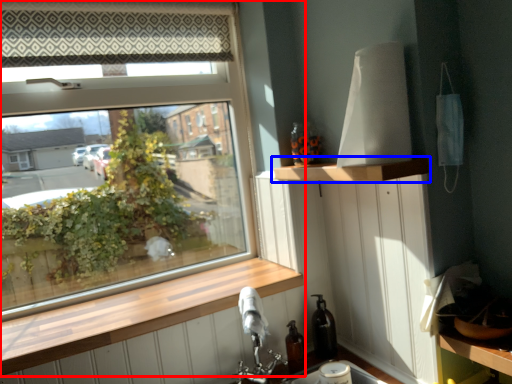
Question: Which object appears closest to the camera in this image, window (highlighted by a red box) or shelf (highlighted by a blue box)?

Choices:
 (A) window
 (B) shelf

Answer: (B)